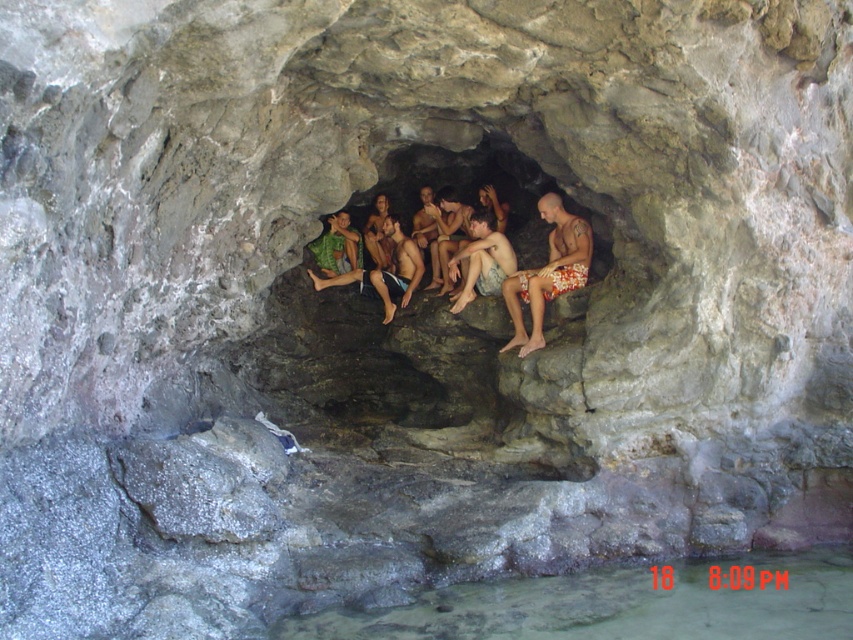
You are planning to take a photo of the clear water at lower center and the floral print shorts at center. Since you want both subjects to be in the frame, which object should you position closer to the camera to ensure they appear similar in size?

The clear water at lower center is wider than the floral print shorts at center. To make them appear similar in size in the photo, position the floral print shorts at center closer to the camera since it is narrower and needs to be magnified to match the size of the clear water at lower center.

You are standing inside the cave and want to take a photo of both the point at coordinates point (508, 346) and point (401, 236). Which point should you focus on first to ensure both are in focus?

You should focus on point (508, 346) first because it is closer to the camera than point (401, 236), ensuring both points are within the depth of field.